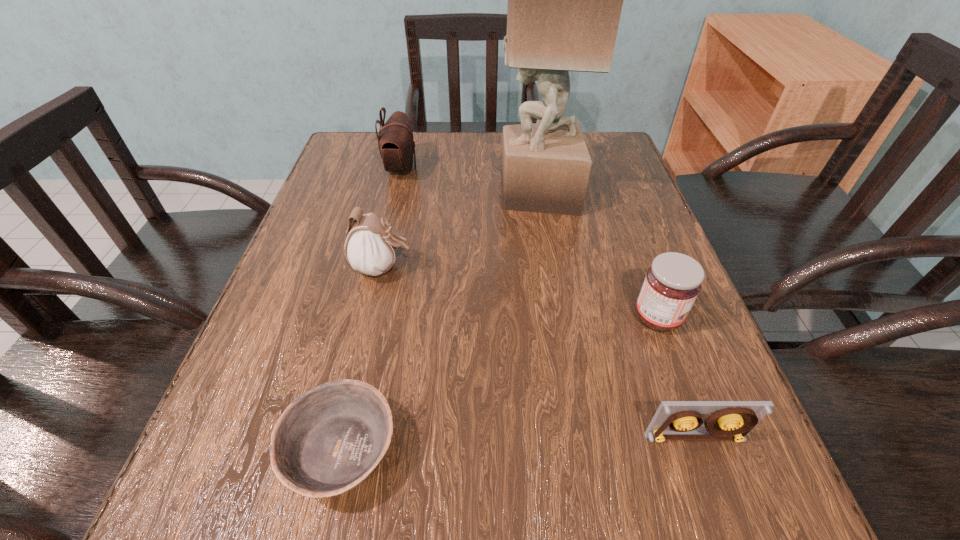
At what (x,y) coordinates should I click in order to perform the action: click on free area in between the fourth nearest object and the fourth farthest object. Please return your answer as a coordinate pair (x, y). The image size is (960, 540). Looking at the image, I should click on (520, 293).

Find the location of a particular element. This screenshot has height=540, width=960. object that stands as the fifth closest to the third nearest object is located at coordinates pyautogui.click(x=396, y=144).

Select which object is the second closest to the third farthest object. Please provide its 2D coordinates. Your answer should be formatted as a tuple, i.e. [(x, y)], where the tuple contains the x and y coordinates of a point satisfying the conditions above.

[(329, 440)]

Where is `blank area in the image that satisfies the following two spatial constraints: 1. with the flap open on the shortest object; 2. on the right side of the farther pouch`? The height and width of the screenshot is (540, 960). blank area in the image that satisfies the following two spatial constraints: 1. with the flap open on the shortest object; 2. on the right side of the farther pouch is located at coordinates (334, 451).

Find the location of a particular element. The height and width of the screenshot is (540, 960). vacant position in the image that satisfies the following two spatial constraints: 1. with the flap open on the third nearest object; 2. on the left side of the farther pouch is located at coordinates (366, 318).

Where is `free spot that satisfies the following two spatial constraints: 1. on the front-facing side of the nearer pouch; 2. on the front side of the bowl`? This screenshot has height=540, width=960. free spot that satisfies the following two spatial constraints: 1. on the front-facing side of the nearer pouch; 2. on the front side of the bowl is located at coordinates (342, 451).

Locate an element on the screen. free spot that satisfies the following two spatial constraints: 1. with the flap open on the bowl; 2. on the right side of the farther pouch is located at coordinates 334,451.

Find the location of a particular element. free space that satisfies the following two spatial constraints: 1. on the back side of the shortest object; 2. with the flap open on the farther pouch is located at coordinates (405, 168).

The image size is (960, 540). What are the coordinates of `vacant position in the image that satisfies the following two spatial constraints: 1. on the front-facing side of the nearer pouch; 2. on the front side of the bowl` in the screenshot? It's located at (342, 451).

Locate an element on the screen. The image size is (960, 540). vacant space that satisfies the following two spatial constraints: 1. with the flap open on the shortest object; 2. on the left side of the farther pouch is located at coordinates (334, 451).